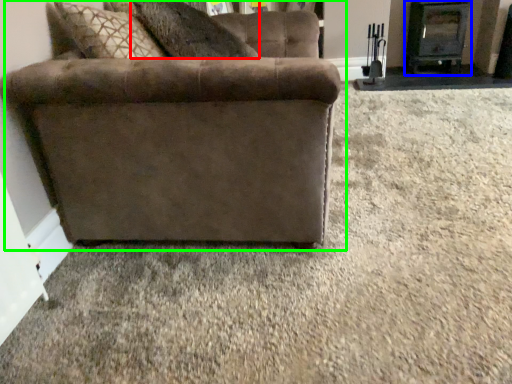
Question: Considering the real-world distances, which object is farthest from pillow (highlighted by a red box)? fireplace (highlighted by a blue box) or studio couch (highlighted by a green box)?

Choices:
 (A) fireplace
 (B) studio couch

Answer: (A)